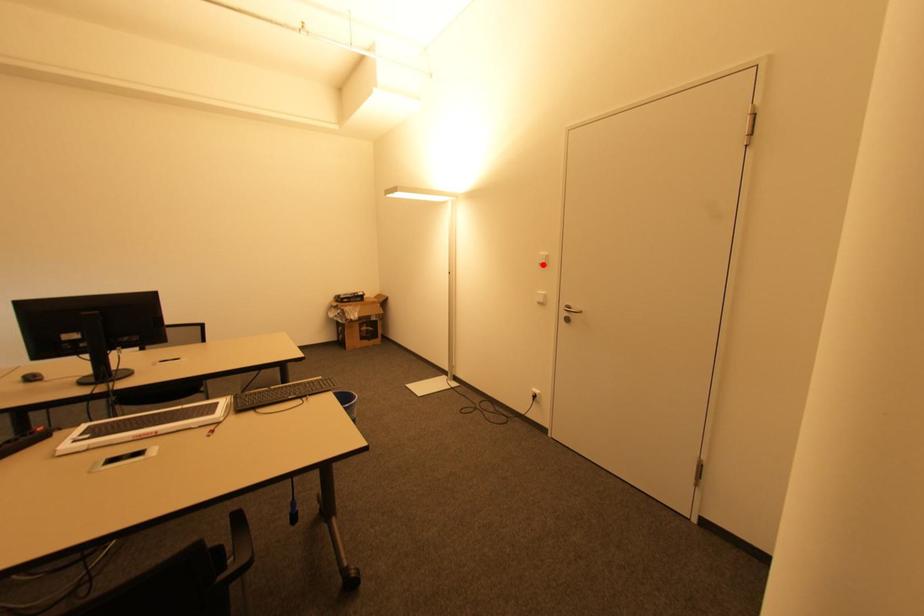
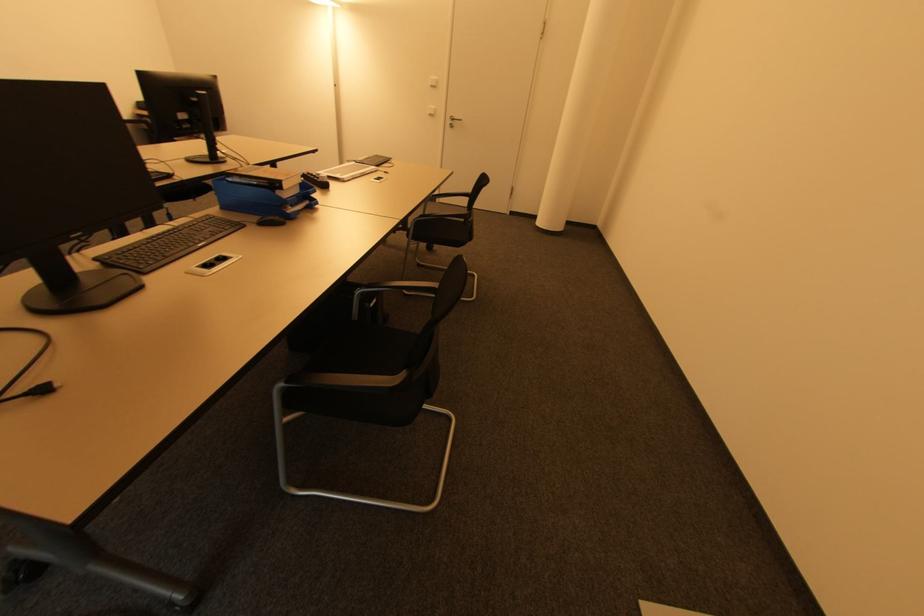
The point at the highlighted location is marked in the first image. Where is the corresponding point in the second image?

(434, 87)